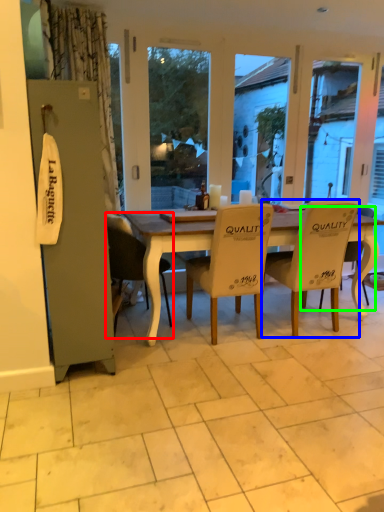
Question: Which object is positioned closest to chair (highlighted by a red box)? Select from chair (highlighted by a blue box) and chair (highlighted by a green box).

Choices:
 (A) chair
 (B) chair

Answer: (A)